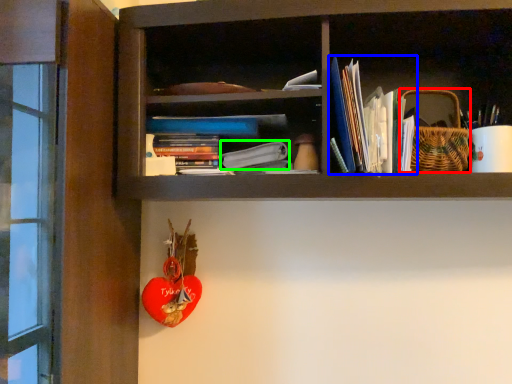
Question: Which object is positioned farthest from basket (highlighted by a red box)? Select from book (highlighted by a blue box) and paperback book (highlighted by a green box).

Choices:
 (A) book
 (B) paperback book

Answer: (B)